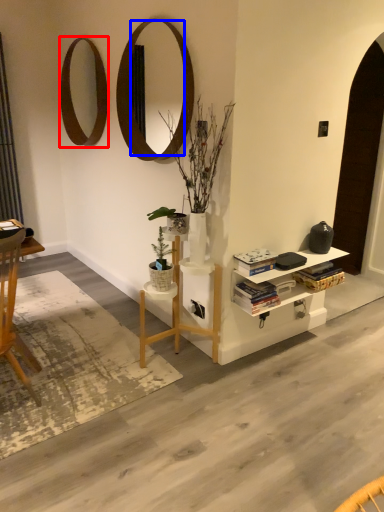
Question: Among these objects, which one is farthest to the camera, mirror (highlighted by a red box) or mirror (highlighted by a blue box)?

Choices:
 (A) mirror
 (B) mirror

Answer: (A)